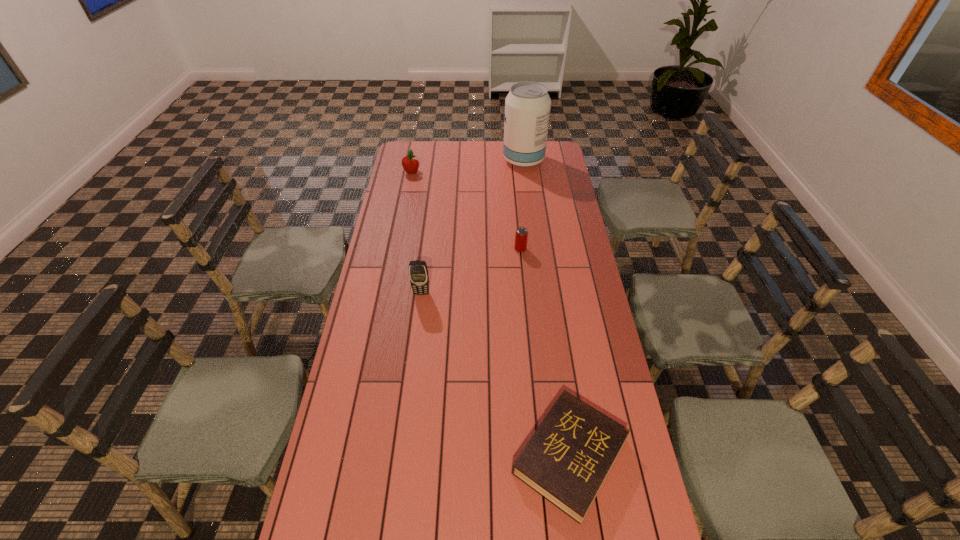
The height and width of the screenshot is (540, 960). In order to click on vacant area that lies between the third nearest object and the fourth farthest object in this screenshot , I will do (x=470, y=271).

Find the location of `unoccupied area between the shortest object and the beer can`. unoccupied area between the shortest object and the beer can is located at coordinates (545, 353).

Locate an element on the screen. free spot between the second tallest object and the apple is located at coordinates (417, 232).

Locate an element on the screen. The width and height of the screenshot is (960, 540). vacant area between the nearest object and the leftmost object is located at coordinates (491, 314).

Where is `free space between the alcohol and the third farthest object`? The width and height of the screenshot is (960, 540). free space between the alcohol and the third farthest object is located at coordinates (522, 205).

The height and width of the screenshot is (540, 960). In order to click on vacant area that lies between the cellular telephone and the tallest object in this screenshot , I will do `click(472, 227)`.

Locate an element on the screen. Image resolution: width=960 pixels, height=540 pixels. empty space between the third nearest object and the alcohol is located at coordinates (522, 205).

Find the location of a particular element. The width and height of the screenshot is (960, 540). vacant space in between the beer can and the hardback book is located at coordinates (545, 353).

Locate an element on the screen. This screenshot has height=540, width=960. empty space between the alcohol and the leftmost object is located at coordinates (468, 166).

Identify the location of free point between the tallest object and the shortest object. Image resolution: width=960 pixels, height=540 pixels. (547, 308).